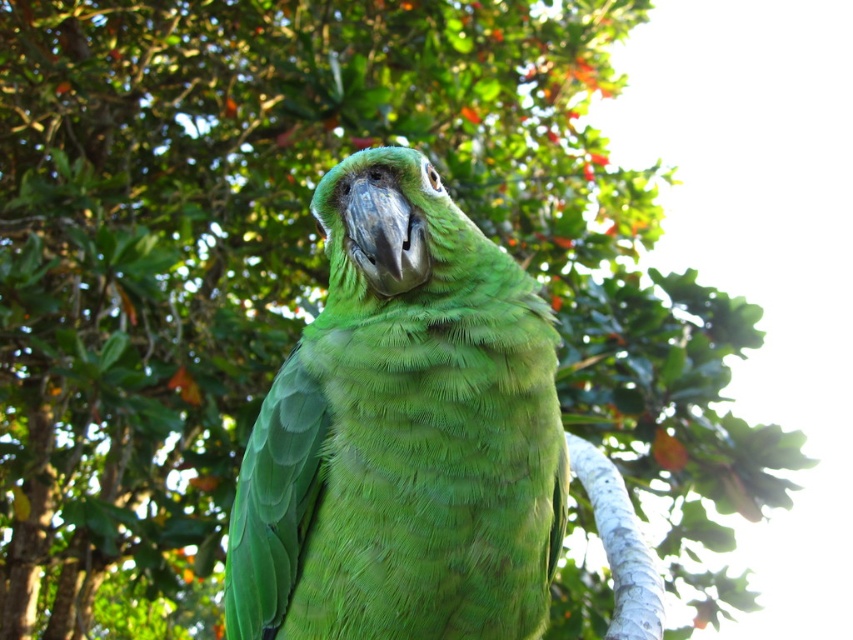
Question: Which object appears closest to the camera in this image?

Choices:
 (A) green feathered parrot at center
 (B) white smooth tree branch at center

Answer: (A)

Question: Does green feathered parrot at center appear under white smooth tree branch at center?

Choices:
 (A) yes
 (B) no

Answer: (B)

Question: Can you confirm if green feathered parrot at center is positioned to the left of white smooth tree branch at center?

Choices:
 (A) no
 (B) yes

Answer: (B)

Question: Can you confirm if green feathered parrot at center is smaller than white smooth tree branch at center?

Choices:
 (A) no
 (B) yes

Answer: (A)